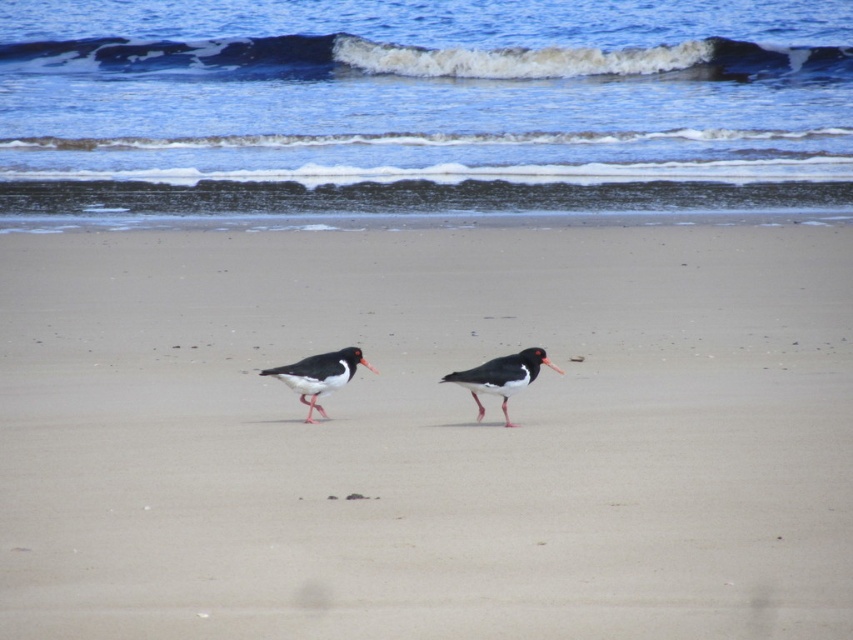
Between point (833, 253) and point (498, 358), which one is positioned behind?

Positioned behind is point (833, 253).

Between smooth sand at center and black matte bird at center, which one appears on the left side from the viewer's perspective?

black matte bird at center

Image resolution: width=853 pixels, height=640 pixels. I want to click on smooth sand at center, so click(x=427, y=435).

This screenshot has width=853, height=640. Find the location of `smooth sand at center`. smooth sand at center is located at coordinates (427, 435).

Image resolution: width=853 pixels, height=640 pixels. I want to click on black matte bird at center, so click(502, 376).

Who is positioned more to the right, black matte bird at center or black glossy oystercatcher at center?

black matte bird at center

In the scene shown: Measure the distance between point (546, 364) and camera.

The distance of point (546, 364) from camera is 8.33 meters.

Identify the location of black matte bird at center. Image resolution: width=853 pixels, height=640 pixels. (502, 376).

What do you see at coordinates (427, 435) in the screenshot? I see `smooth sand at center` at bounding box center [427, 435].

Looking at this image, measure the distance between smooth sand at center and camera.

smooth sand at center is 16.64 feet from camera.

Which is behind, point (685, 268) or point (305, 388)?

The point (685, 268) is more distant.

You are a GUI agent. You are given a task and a screenshot of the screen. Output one action in this format:
    pyautogui.click(x=<x>, y=<y>)
    Task: Click on the smooth sand at center
    
    Given the screenshot: What is the action you would take?
    pyautogui.click(x=427, y=435)